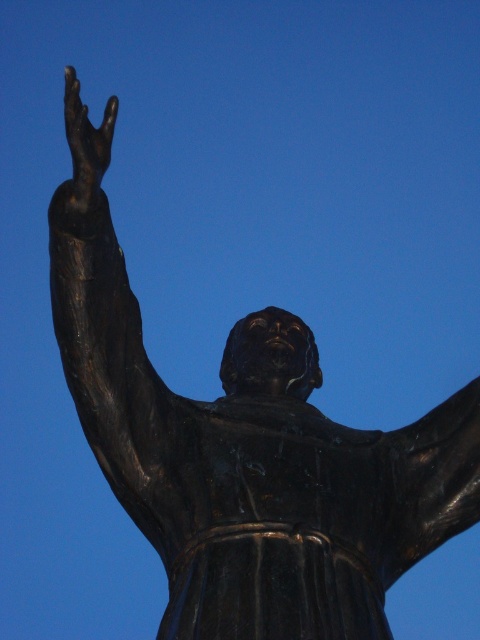
Question: Can you confirm if black polished statue arm at upper left is positioned above black polished hand at upper left?

Choices:
 (A) yes
 (B) no

Answer: (B)

Question: Is black polished statue arm at upper left wider than black polished hand at upper left?

Choices:
 (A) no
 (B) yes

Answer: (B)

Question: Is black polished statue arm at upper left smaller than black polished hand at upper left?

Choices:
 (A) no
 (B) yes

Answer: (A)